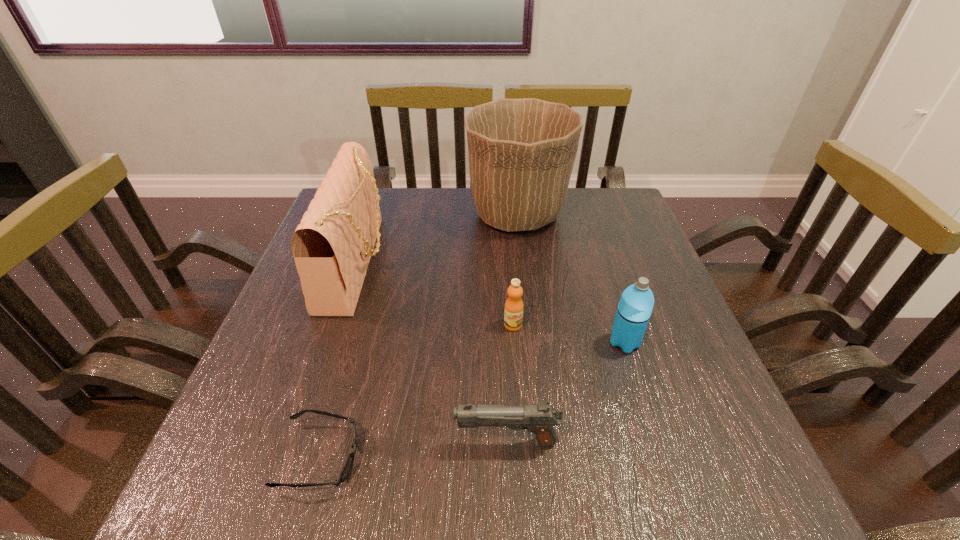
Choose which object is the fourth nearest neighbor to the shortest object. Please provide its 2D coordinates. Your answer should be formatted as a tuple, i.e. [(x, y)], where the tuple contains the x and y coordinates of a point satisfying the conditions above.

[(635, 307)]

In order to click on vacant space that satisfies the following two spatial constraints: 1. on the front-facing side of the handbag; 2. on the right side of the third tallest object in this screenshot , I will do `click(331, 342)`.

Where is `free space that satisfies the following two spatial constraints: 1. on the front side of the flowerpot; 2. on the front-facing side of the handbag`? The height and width of the screenshot is (540, 960). free space that satisfies the following two spatial constraints: 1. on the front side of the flowerpot; 2. on the front-facing side of the handbag is located at coordinates (523, 263).

The height and width of the screenshot is (540, 960). Find the location of `vacant position in the image that satisfies the following two spatial constraints: 1. on the front label of the orange juice; 2. in the direction the gun is aimed`. vacant position in the image that satisfies the following two spatial constraints: 1. on the front label of the orange juice; 2. in the direction the gun is aimed is located at coordinates (522, 442).

Identify the location of vacant space that satisfies the following two spatial constraints: 1. on the front label of the orange juice; 2. in the direction the gun is aimed. (522, 442).

This screenshot has height=540, width=960. Find the location of `free space that satisfies the following two spatial constraints: 1. on the front label of the orange juice; 2. in the direction the gun is aimed`. free space that satisfies the following two spatial constraints: 1. on the front label of the orange juice; 2. in the direction the gun is aimed is located at coordinates (522, 442).